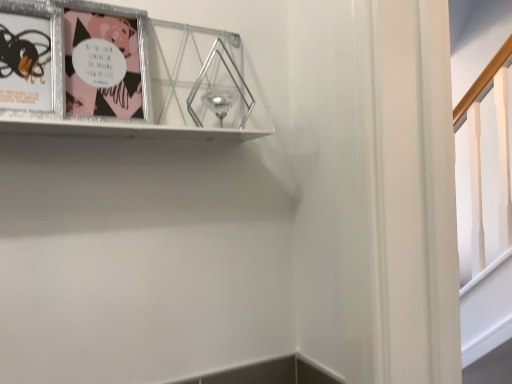
Where is `metallic silver picture frame at upper left, placed as the 3th picture frame when sorted from right to left`? This screenshot has width=512, height=384. metallic silver picture frame at upper left, placed as the 3th picture frame when sorted from right to left is located at coordinates (30, 58).

What is the approximate height of metallic silver picture frame at upper left, the 2th picture frame positioned from the right?

The height of metallic silver picture frame at upper left, the 2th picture frame positioned from the right, is 7.78 inches.

Where is `metallic silver picture frame at upper left, placed as the 3th picture frame when sorted from right to left`? The image size is (512, 384). metallic silver picture frame at upper left, placed as the 3th picture frame when sorted from right to left is located at coordinates (30, 58).

From the image's perspective, relative to metallic silver picture frame at upper left, the 1th picture frame viewed from the left, is metallic silver picture frame at upper left, the 2th picture frame positioned from the right, above or below?

metallic silver picture frame at upper left, the 2th picture frame positioned from the right, is above metallic silver picture frame at upper left, the 1th picture frame viewed from the left.

Is metallic silver picture frame at upper left, the 2th picture frame positioned from the right, positioned with its back to metallic silver picture frame at upper left, the 1th picture frame viewed from the left?

No, metallic silver picture frame at upper left, the 1th picture frame viewed from the left, is not at the back of metallic silver picture frame at upper left, the 2th picture frame positioned from the right.

How many degrees apart are the facing directions of metallic silver picture frame at upper left, the second picture frame when ordered from left to right, and metallic silver picture frame at upper left, placed as the 3th picture frame when sorted from right to left?

There is a 2.49-degree angle between the facing directions of metallic silver picture frame at upper left, the second picture frame when ordered from left to right, and metallic silver picture frame at upper left, placed as the 3th picture frame when sorted from right to left.

The image size is (512, 384). Identify the location of picture frame that is the 2nd object located below the metallic silver picture frame at upper left, the second picture frame when ordered from left to right (from the image's perspective). (30, 58).

From the image's perspective, between metallic silver picture frame at upper left, the 1th picture frame viewed from the left, and metallic silver picture frame at upper left, the 2th picture frame positioned from the right, which one is located above?

metallic silver picture frame at upper left, the 2th picture frame positioned from the right, appears higher in the image.

Is metallic silver picture frame at upper left, placed as the 3th picture frame when sorted from right to left, positioned with its back to metallic silver picture frame at upper left, the 2th picture frame positioned from the right?

No, metallic silver picture frame at upper left, the 2th picture frame positioned from the right, is not at the back of metallic silver picture frame at upper left, placed as the 3th picture frame when sorted from right to left.

From a real-world perspective, is metallic silver picture frame at upper left, the 1th picture frame viewed from the left, located beneath metallic silver picture frame at upper left, the 2th picture frame positioned from the right?

Yes, from a real-world perspective, metallic silver picture frame at upper left, the 1th picture frame viewed from the left, is under metallic silver picture frame at upper left, the 2th picture frame positioned from the right.

Considering the points (25, 57) and (94, 9), which point is behind, point (25, 57) or point (94, 9)?

Positioned behind is point (94, 9).

From the image's perspective, between metallic silver picture frame at upper left, the 2th picture frame positioned from the right, and metallic silver picture frame at upper left, the third picture frame from the left, which one is located above?

metallic silver picture frame at upper left, the 2th picture frame positioned from the right, appears higher in the image.

Is metallic silver picture frame at upper left, acting as the first picture frame starting from the right, completely or partially inside metallic silver picture frame at upper left, the second picture frame when ordered from left to right?

No.

Looking at this image, would you consider metallic silver picture frame at upper left, the second picture frame when ordered from left to right, to be distant from metallic silver picture frame at upper left, the third picture frame from the left?

No, metallic silver picture frame at upper left, the second picture frame when ordered from left to right, is not far from metallic silver picture frame at upper left, the third picture frame from the left.

Considering their positions, is metallic silver picture frame at upper left, the second picture frame when ordered from left to right, located in front of or behind metallic silver picture frame at upper left, acting as the first picture frame starting from the right?

Clearly, metallic silver picture frame at upper left, the second picture frame when ordered from left to right, is behind metallic silver picture frame at upper left, acting as the first picture frame starting from the right.

From the image's perspective, which one is positioned higher, metallic silver picture frame at upper left, the third picture frame from the left, or metallic silver picture frame at upper left, the 1th picture frame viewed from the left?

metallic silver picture frame at upper left, the third picture frame from the left, is shown above in the image.

Is metallic silver picture frame at upper left, acting as the first picture frame starting from the right, at the right side of metallic silver picture frame at upper left, placed as the 3th picture frame when sorted from right to left?

Indeed, metallic silver picture frame at upper left, acting as the first picture frame starting from the right, is positioned on the right side of metallic silver picture frame at upper left, placed as the 3th picture frame when sorted from right to left.

How far apart are metallic silver picture frame at upper left, acting as the first picture frame starting from the right, and metallic silver picture frame at upper left, placed as the 3th picture frame when sorted from right to left?

metallic silver picture frame at upper left, acting as the first picture frame starting from the right, is 4.54 inches from metallic silver picture frame at upper left, placed as the 3th picture frame when sorted from right to left.

From the image's perspective, is metallic silver picture frame at upper left, acting as the first picture frame starting from the right, beneath metallic silver picture frame at upper left, the second picture frame when ordered from left to right?

Correct, metallic silver picture frame at upper left, acting as the first picture frame starting from the right, appears lower than metallic silver picture frame at upper left, the second picture frame when ordered from left to right, in the image.

Considering the sizes of objects metallic silver picture frame at upper left, acting as the first picture frame starting from the right, and metallic silver picture frame at upper left, the 2th picture frame positioned from the right, in the image provided, who is smaller, metallic silver picture frame at upper left, acting as the first picture frame starting from the right, or metallic silver picture frame at upper left, the 2th picture frame positioned from the right,?

metallic silver picture frame at upper left, the 2th picture frame positioned from the right.

Which is further, (145, 55) or (102, 114)?

Positioned behind is point (145, 55).

Are metallic silver picture frame at upper left, acting as the first picture frame starting from the right, and metallic silver picture frame at upper left, the 2th picture frame positioned from the right, located far from each other?

No, metallic silver picture frame at upper left, acting as the first picture frame starting from the right, is not far from metallic silver picture frame at upper left, the 2th picture frame positioned from the right.

Is metallic silver picture frame at upper left, the 1th picture frame viewed from the left, aimed at metallic silver picture frame at upper left, acting as the first picture frame starting from the right?

Yes, metallic silver picture frame at upper left, the 1th picture frame viewed from the left, is aimed at metallic silver picture frame at upper left, acting as the first picture frame starting from the right.

Is metallic silver picture frame at upper left, the 1th picture frame viewed from the left, thinner than metallic silver picture frame at upper left, the third picture frame from the left?

Correct, the width of metallic silver picture frame at upper left, the 1th picture frame viewed from the left, is less than that of metallic silver picture frame at upper left, the third picture frame from the left.

Does point (15, 71) come farther from viewer compared to point (14, 124)?

That is False.

Can you confirm if metallic silver picture frame at upper left, the 1th picture frame viewed from the left, is taller than metallic silver picture frame at upper left, acting as the first picture frame starting from the right?

No, metallic silver picture frame at upper left, the 1th picture frame viewed from the left, is not taller than metallic silver picture frame at upper left, acting as the first picture frame starting from the right.

Locate an element on the screen. The width and height of the screenshot is (512, 384). picture frame to the left of metallic silver picture frame at upper left, the 2th picture frame positioned from the right is located at coordinates [x=30, y=58].

Find the location of `the 2nd picture frame above the metallic silver picture frame at upper left, the 1th picture frame viewed from the left (from the image's perspective)`. the 2nd picture frame above the metallic silver picture frame at upper left, the 1th picture frame viewed from the left (from the image's perspective) is located at coordinates pyautogui.click(x=105, y=61).

Estimate the real-world distances between objects in this image. Which object is further from metallic silver picture frame at upper left, acting as the first picture frame starting from the right, metallic silver picture frame at upper left, the second picture frame when ordered from left to right, or metallic silver picture frame at upper left, placed as the 3th picture frame when sorted from right to left?

metallic silver picture frame at upper left, placed as the 3th picture frame when sorted from right to left.

Based on their spatial positions, is metallic silver picture frame at upper left, the second picture frame when ordered from left to right, or metallic silver picture frame at upper left, acting as the first picture frame starting from the right, further from metallic silver picture frame at upper left, the 1th picture frame viewed from the left?

metallic silver picture frame at upper left, acting as the first picture frame starting from the right, lies further to metallic silver picture frame at upper left, the 1th picture frame viewed from the left, than the other object.

When comparing their distances from metallic silver picture frame at upper left, the 2th picture frame positioned from the right, does metallic silver picture frame at upper left, acting as the first picture frame starting from the right, or metallic silver picture frame at upper left, the 1th picture frame viewed from the left, seem further?

Among the two, metallic silver picture frame at upper left, the 1th picture frame viewed from the left, is located further to metallic silver picture frame at upper left, the 2th picture frame positioned from the right.

When comparing their distances from metallic silver picture frame at upper left, the 2th picture frame positioned from the right, does metallic silver picture frame at upper left, placed as the 3th picture frame when sorted from right to left, or metallic silver picture frame at upper left, the third picture frame from the left, seem closer?

metallic silver picture frame at upper left, the third picture frame from the left, is closer to metallic silver picture frame at upper left, the 2th picture frame positioned from the right.

Considering their positions, is metallic silver picture frame at upper left, placed as the 3th picture frame when sorted from right to left, positioned further to metallic silver picture frame at upper left, acting as the first picture frame starting from the right, than metallic silver picture frame at upper left, the second picture frame when ordered from left to right?

The object further to metallic silver picture frame at upper left, acting as the first picture frame starting from the right, is metallic silver picture frame at upper left, placed as the 3th picture frame when sorted from right to left.

Which object lies nearer to the anchor point metallic silver picture frame at upper left, the 1th picture frame viewed from the left, metallic silver picture frame at upper left, the third picture frame from the left, or metallic silver picture frame at upper left, the second picture frame when ordered from left to right?

The object closer to metallic silver picture frame at upper left, the 1th picture frame viewed from the left, is metallic silver picture frame at upper left, the second picture frame when ordered from left to right.

This screenshot has width=512, height=384. Find the location of `picture frame between metallic silver picture frame at upper left, the 1th picture frame viewed from the left, and metallic silver picture frame at upper left, acting as the first picture frame starting from the right, in the horizontal direction`. picture frame between metallic silver picture frame at upper left, the 1th picture frame viewed from the left, and metallic silver picture frame at upper left, acting as the first picture frame starting from the right, in the horizontal direction is located at coordinates (105, 61).